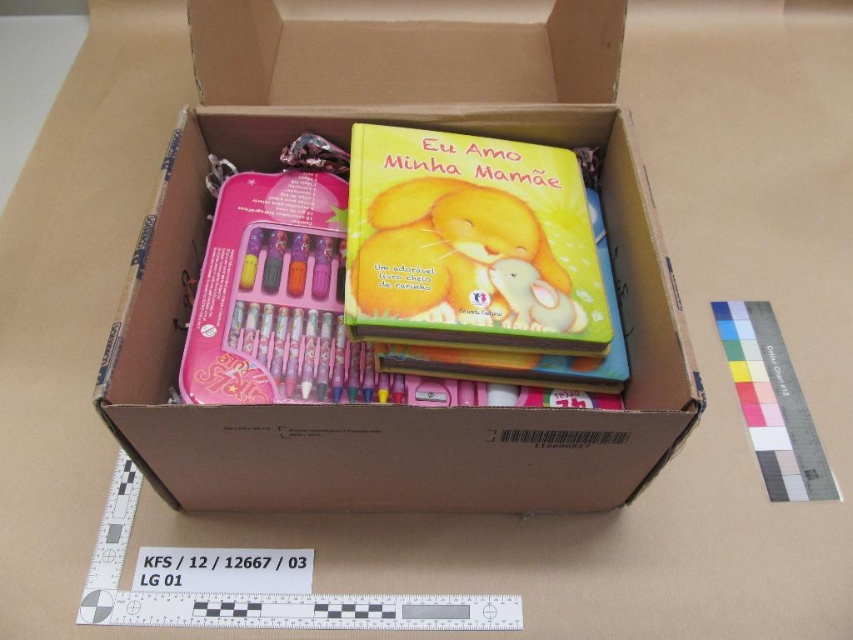
You are organizing items in a cardboard box on a desk. You need to place a new item at the exact center of the box. The box has a point at coordinates point (x=343, y=145). Is this point suitable for placing the new item?

The point (x=343, y=145) is on the matte cardboard box at center, so this point is suitable for placing the new item at the exact center of the box.

You have a small toy car that is 10 centimeters long. You want to place it inside the matte cardboard box at center. Can the toy car fit horizontally if the box is as wide as the white plastic ruler at upper right?

The matte cardboard box at center might be wider than the white plastic ruler at upper right. Since the box is as wide as the ruler, the toy car that is 10 centimeters long can fit horizontally if the ruler is at least 10 centimeters long. However, without knowing the exact length of the ruler, we cannot confirm for certain.